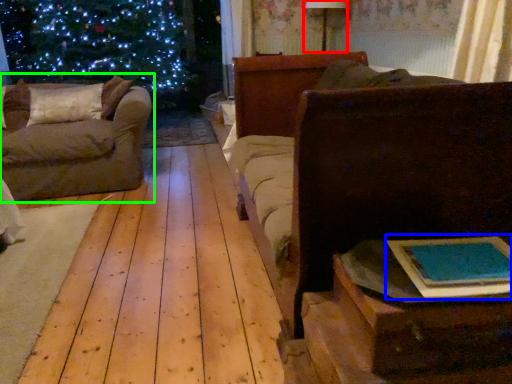
Question: Which is nearer to the lamp (highlighted by a red box)? book (highlighted by a blue box) or studio couch (highlighted by a green box).

Choices:
 (A) book
 (B) studio couch

Answer: (B)